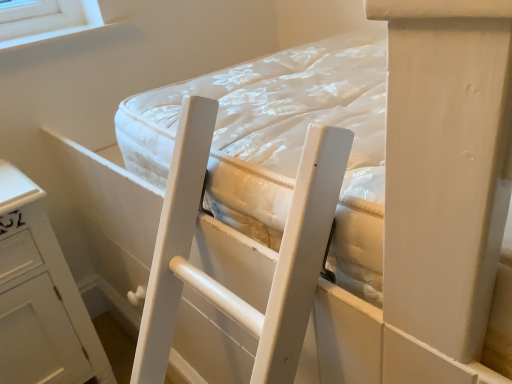
At what (x,y) coordinates should I click in order to perform the action: click on white glossy cabinet at lower left. Please return your answer as a coordinate pair (x, y). Looking at the image, I should click on (40, 297).

Describe the element at coordinates (40, 297) in the screenshot. The width and height of the screenshot is (512, 384). I see `white glossy cabinet at lower left` at that location.

Locate an element on the screen. white glossy cabinet at lower left is located at coordinates (40, 297).